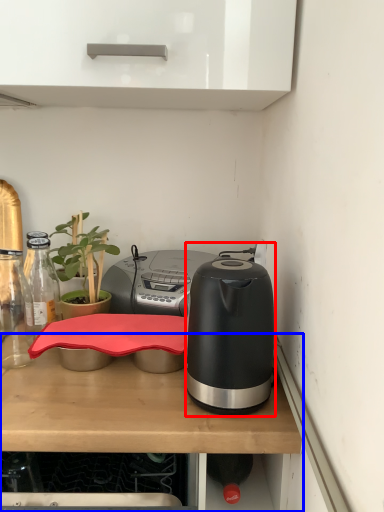
Question: Among these objects, which one is farthest to the camera, kitchen appliance (highlighted by a red box) or desk (highlighted by a blue box)?

Choices:
 (A) kitchen appliance
 (B) desk

Answer: (A)